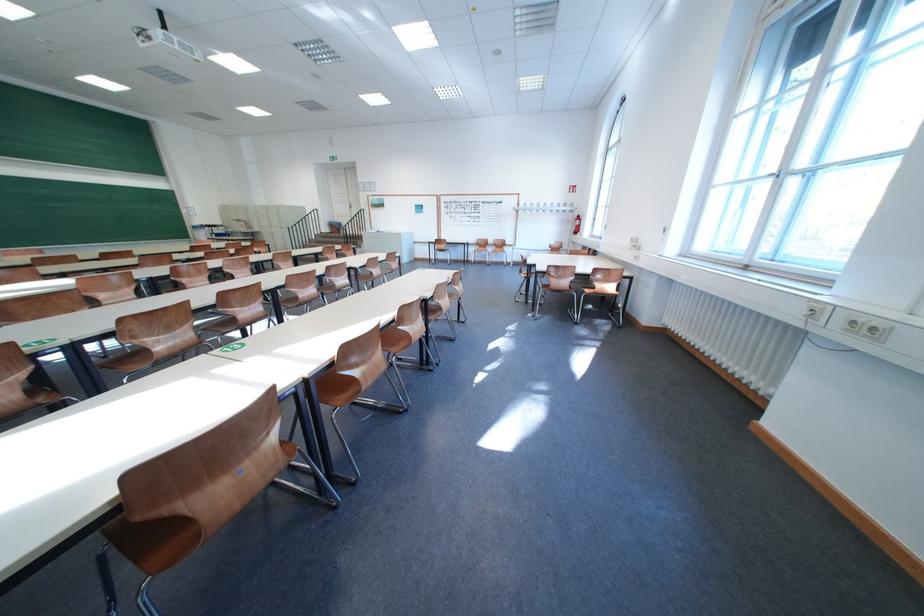
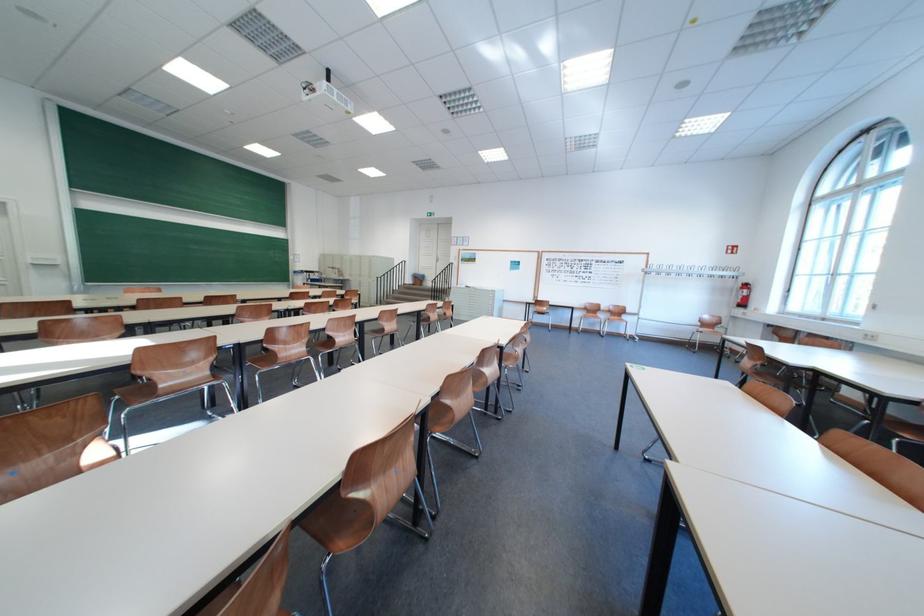
In the second image, find the point that corresponds to point (524, 205) in the first image.

(649, 265)